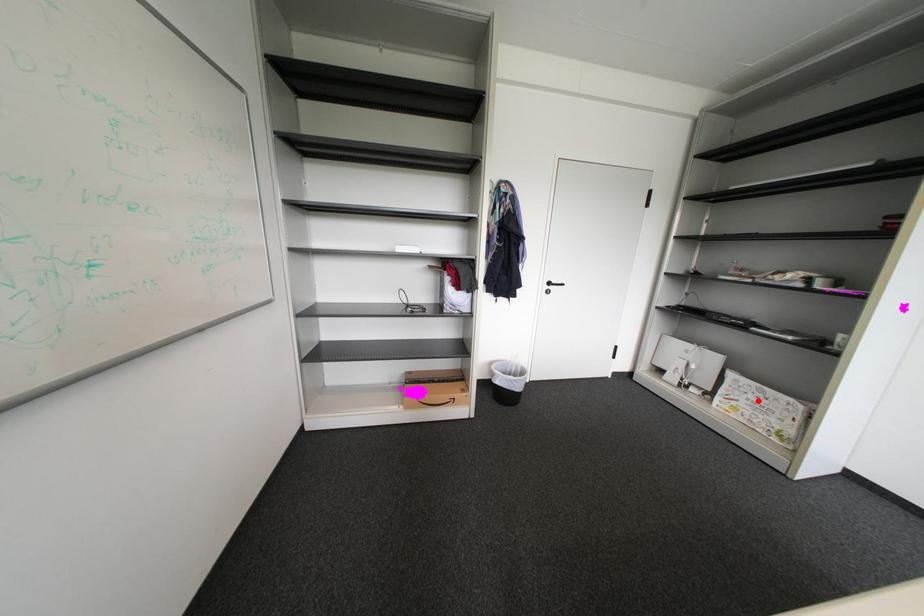
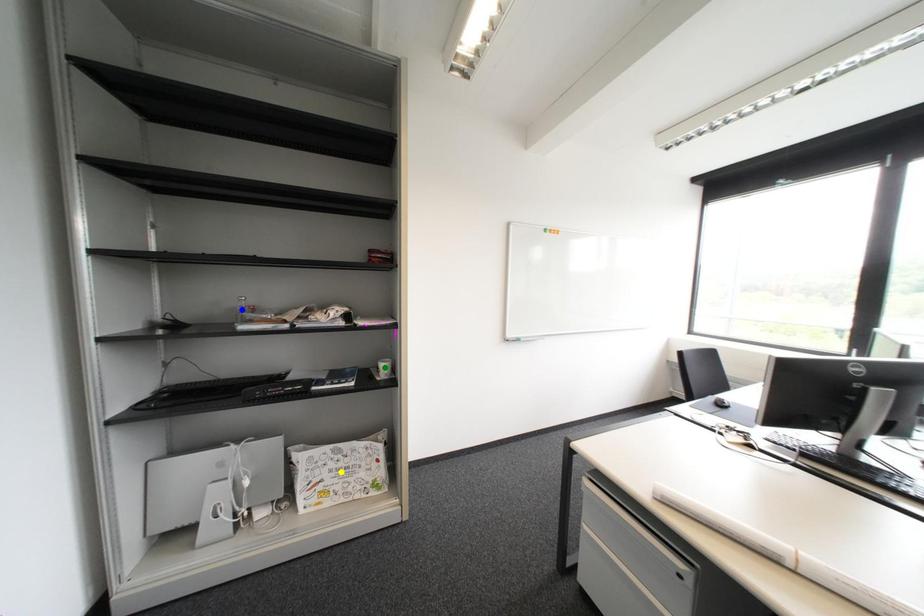
Question: I am providing you with two images of the same scene from different viewpoints. A red point is marked on the first image. You are given multiple points on the second image. Which spot in image 2 lines up with the point in image 1?

Choices:
 (A) blue point
 (B) green point
 (C) yellow point

Answer: (C)